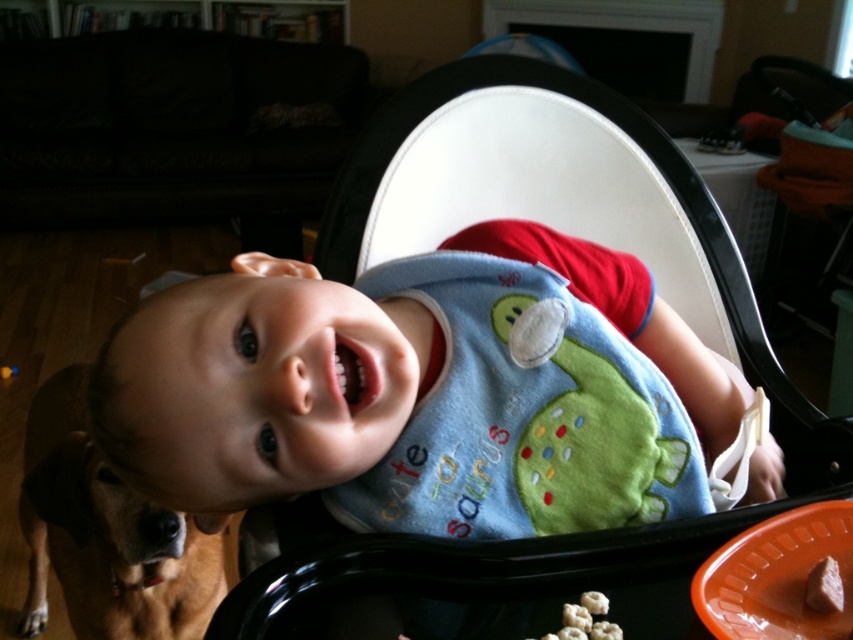
Question: Which is farther from the white fluffy popcorn at lower center?

Choices:
 (A) cute fabric bib at center
 (B) black plastic highchair at center

Answer: (B)

Question: Does cute fabric bib at center appear on the right side of white fluffy popcorn at lower center?

Choices:
 (A) yes
 (B) no

Answer: (B)

Question: Can you confirm if black plastic highchair at center is thinner than brown matte cookie at lower right?

Choices:
 (A) no
 (B) yes

Answer: (A)

Question: Which point appears farthest from the camera in this image?

Choices:
 (A) (589, 604)
 (B) (610, 445)
 (C) (830, 573)

Answer: (B)

Question: Does cute fabric bib at center come in front of black plastic highchair at center?

Choices:
 (A) no
 (B) yes

Answer: (B)

Question: Estimate the real-world distances between objects in this image. Which object is closer to the white fluffy popcorn at lower center?

Choices:
 (A) cute fabric bib at center
 (B) brown matte cookie at lower right
 (C) black plastic highchair at center

Answer: (B)